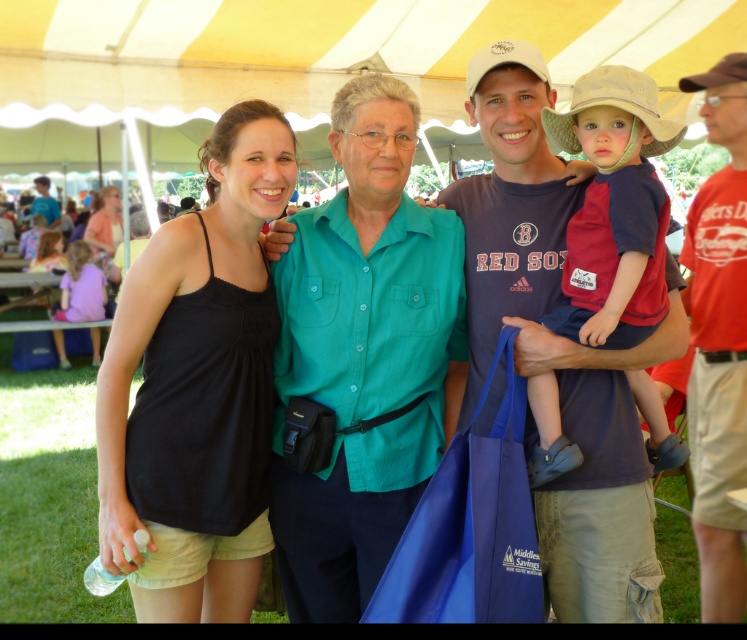
Who is more forward, (329,461) or (96,243)?

Point (329,461) is in front.

Does teal button-down shirt at center appear on the left side of matte black tank top at left?

No, teal button-down shirt at center is not to the left of matte black tank top at left.

Is point (314, 337) closer to camera compared to point (96, 202)?

Yes, it is.

The width and height of the screenshot is (747, 640). In order to click on teal button-down shirt at center in this screenshot , I will do `click(362, 355)`.

Does red cotton shirt at right have a greater height compared to matte black shirt at left?

Correct, red cotton shirt at right is much taller as matte black shirt at left.

Between red cotton shirt at right and matte black shirt at left, which one has less height?

Standing shorter between the two is matte black shirt at left.

Where is `red cotton shirt at right`? red cotton shirt at right is located at coordinates 719,342.

Where is `red cotton shirt at right`? red cotton shirt at right is located at coordinates (719, 342).

Locate an element on the screen. matte blue shirt at center is located at coordinates (557, 346).

Is matte blue shirt at center shorter than brown fabric cowboy hat at upper right?

Incorrect, matte blue shirt at center's height does not fall short of brown fabric cowboy hat at upper right's.

The height and width of the screenshot is (640, 747). I want to click on matte blue shirt at center, so click(x=557, y=346).